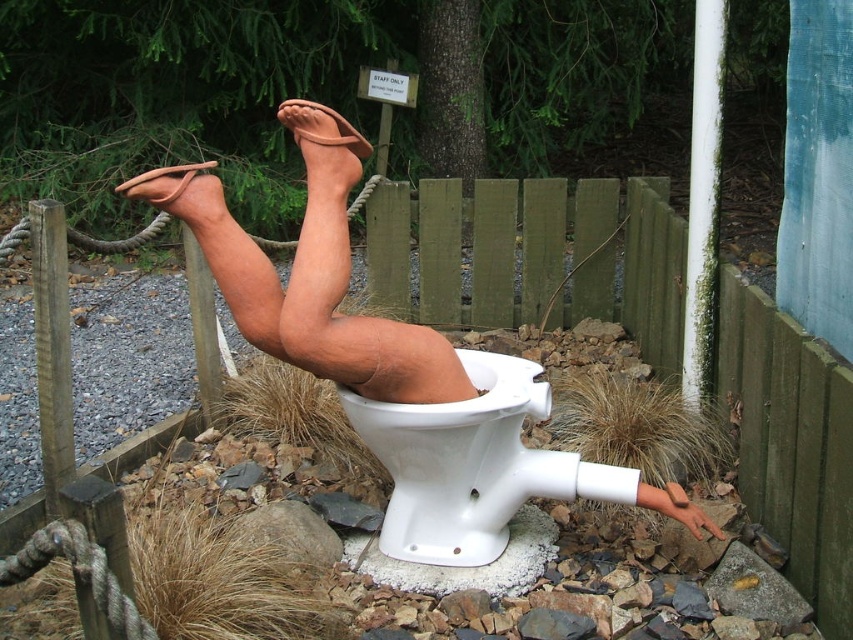
Between matte clay legs at center and brown matte sandal at upper center, which one has more height?

matte clay legs at center

Image resolution: width=853 pixels, height=640 pixels. Identify the location of matte clay legs at center. (386, 356).

Who is more distant from viewer, (289, 124) or (351, 128)?

Positioned behind is point (351, 128).

The image size is (853, 640). I want to click on matte clay legs at center, so click(x=386, y=356).

Identify the location of white glossy toilet bowl at center. The height and width of the screenshot is (640, 853). (462, 461).

Is white glossy toilet bowl at center to the right of brown matte sandal at upper center from the viewer's perspective?

Indeed, white glossy toilet bowl at center is positioned on the right side of brown matte sandal at upper center.

Does point (523, 374) lie in front of point (357, 134)?

No, (523, 374) is further to viewer.

At what (x,y) coordinates should I click in order to perform the action: click on white glossy toilet bowl at center. Please return your answer as a coordinate pair (x, y). The height and width of the screenshot is (640, 853). Looking at the image, I should click on (462, 461).

Locate an element on the screen. white glossy toilet bowl at center is located at coordinates (462, 461).

This screenshot has width=853, height=640. In order to click on white glossy toilet bowl at center in this screenshot , I will do `click(462, 461)`.